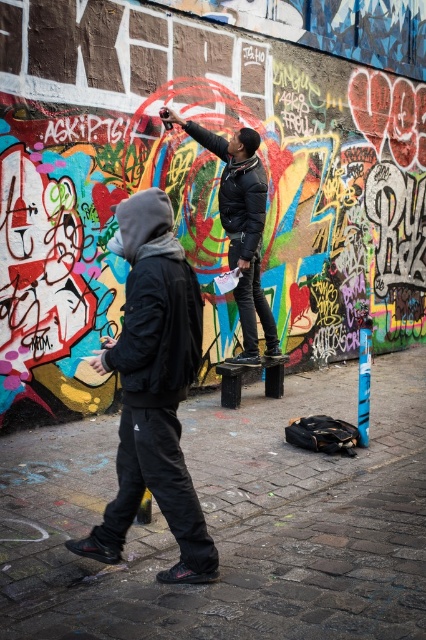
Question: Can you confirm if dark gray hoodie at left is wider than black leather jacket at center?

Choices:
 (A) no
 (B) yes

Answer: (A)

Question: Can you confirm if dark gray hoodie at left is positioned above black leather jacket at center?

Choices:
 (A) yes
 (B) no

Answer: (B)

Question: Does dark gray hoodie at left lie behind black leather jacket at center?

Choices:
 (A) no
 (B) yes

Answer: (A)